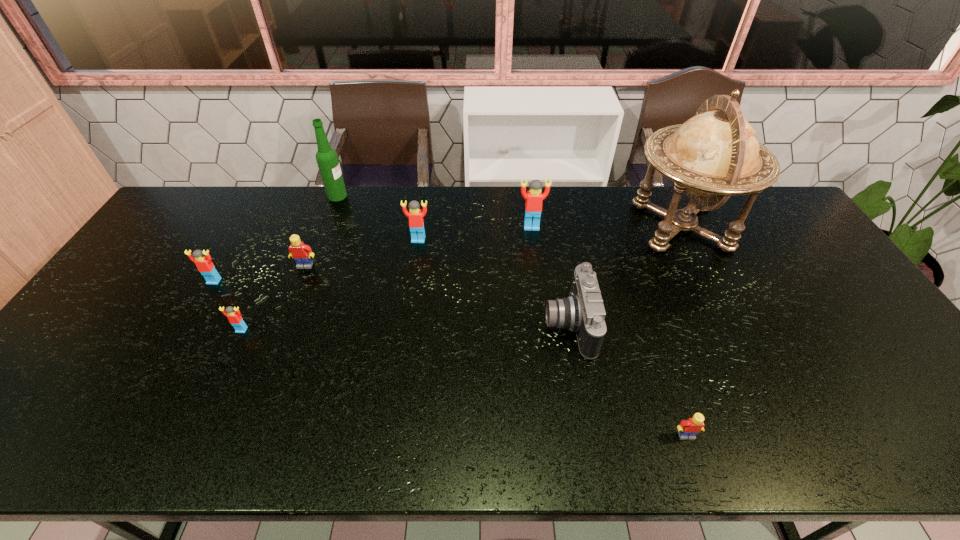
Locate an element on the screen. The width and height of the screenshot is (960, 540). the tallest object is located at coordinates (715, 154).

Locate an element on the screen. The image size is (960, 540). the rightmost object is located at coordinates (715, 154).

The height and width of the screenshot is (540, 960). In order to click on green beer bottle in this screenshot , I will do `click(326, 157)`.

Identify the location of the eighth shortest object. The height and width of the screenshot is (540, 960). (326, 157).

This screenshot has height=540, width=960. I want to click on the second Lego from right to left, so click(534, 197).

Where is `the biggest red Lego`? The image size is (960, 540). the biggest red Lego is located at coordinates (534, 197).

Where is `the fourth Lego from left to right`? Image resolution: width=960 pixels, height=540 pixels. the fourth Lego from left to right is located at coordinates [416, 223].

Where is `the second farthest Lego`? the second farthest Lego is located at coordinates [x=416, y=223].

You are a GUI agent. You are given a task and a screenshot of the screen. Output one action in this format:
    pyautogui.click(x=<x>, y=<y>)
    Task: Click on the camera
    This screenshot has width=960, height=540.
    Given the screenshot: What is the action you would take?
    pyautogui.click(x=583, y=312)

You are a GUI agent. You are given a task and a screenshot of the screen. Output one action in this format:
    pyautogui.click(x=<x>, y=<y>)
    Task: Click on the fourth nearest object
    This screenshot has height=540, width=960.
    Given the screenshot: What is the action you would take?
    pyautogui.click(x=204, y=265)